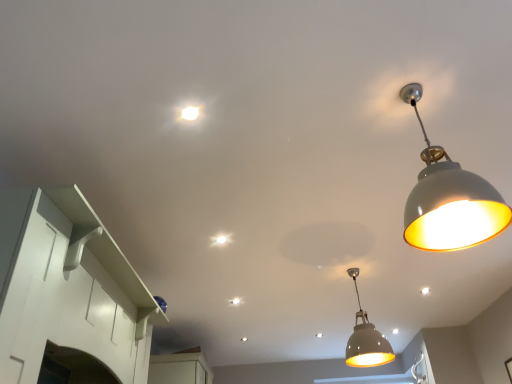
Question: From the image's perspective, is white glossy cabinet at left above matte white pendant light at center, the second lamp from the front?

Choices:
 (A) no
 (B) yes

Answer: (B)

Question: Considering the relative sizes of white glossy cabinet at left and matte white pendant light at center, the first lamp positioned from the back, in the image provided, is white glossy cabinet at left thinner than matte white pendant light at center, the first lamp positioned from the back,?

Choices:
 (A) no
 (B) yes

Answer: (B)

Question: Is white glossy cabinet at left looking in the opposite direction of matte white pendant light at center, the second lamp from the front?

Choices:
 (A) yes
 (B) no

Answer: (B)

Question: Does white glossy cabinet at left have a larger size compared to matte white pendant light at center, the first lamp positioned from the back?

Choices:
 (A) no
 (B) yes

Answer: (A)

Question: Can we say white glossy cabinet at left lies outside matte white pendant light at center, the first lamp in the bottom-to-top sequence?

Choices:
 (A) no
 (B) yes

Answer: (B)

Question: Looking at the image, does matte white pendant light at center, the first lamp positioned from the back, seem bigger or smaller compared to white glossy pendant light at upper right, which is the second lamp from back to front?

Choices:
 (A) big
 (B) small

Answer: (B)

Question: Considering the positions of matte white pendant light at center, the second lamp from the front, and white glossy pendant light at upper right, which is counted as the first lamp, starting from the top, in the image, is matte white pendant light at center, the second lamp from the front, taller or shorter than white glossy pendant light at upper right, which is counted as the first lamp, starting from the top,?

Choices:
 (A) tall
 (B) short

Answer: (B)

Question: From the image's perspective, is matte white pendant light at center, the second lamp from the front, positioned above or below white glossy pendant light at upper right, the second lamp from the bottom?

Choices:
 (A) above
 (B) below

Answer: (B)

Question: Considering the positions of point (376, 342) and point (468, 223), is point (376, 342) closer or farther from the camera than point (468, 223)?

Choices:
 (A) farther
 (B) closer

Answer: (A)

Question: Is point (194, 117) positioned closer to the camera than point (466, 215)?

Choices:
 (A) farther
 (B) closer

Answer: (A)

Question: In the image, is white glossy light bulb at upper center on the left side or the right side of white glossy pendant light at upper right, the second lamp from the bottom?

Choices:
 (A) right
 (B) left

Answer: (B)

Question: From the image's perspective, is white glossy light bulb at upper center positioned above or below white glossy pendant light at upper right, which is the first lamp in front-to-back order?

Choices:
 (A) below
 (B) above

Answer: (B)

Question: Considering their positions, is white glossy light bulb at upper center located in front of or behind white glossy pendant light at upper right, which is the first lamp in front-to-back order?

Choices:
 (A) front
 (B) behind

Answer: (B)

Question: From a real-world perspective, relative to white glossy light bulb at upper center, is matte white pendant light at center, the first lamp positioned from the back, vertically above or below?

Choices:
 (A) below
 (B) above

Answer: (A)

Question: In terms of width, does matte white pendant light at center, the second lamp from the front, look wider or thinner when compared to white glossy light bulb at upper center?

Choices:
 (A) thin
 (B) wide

Answer: (B)